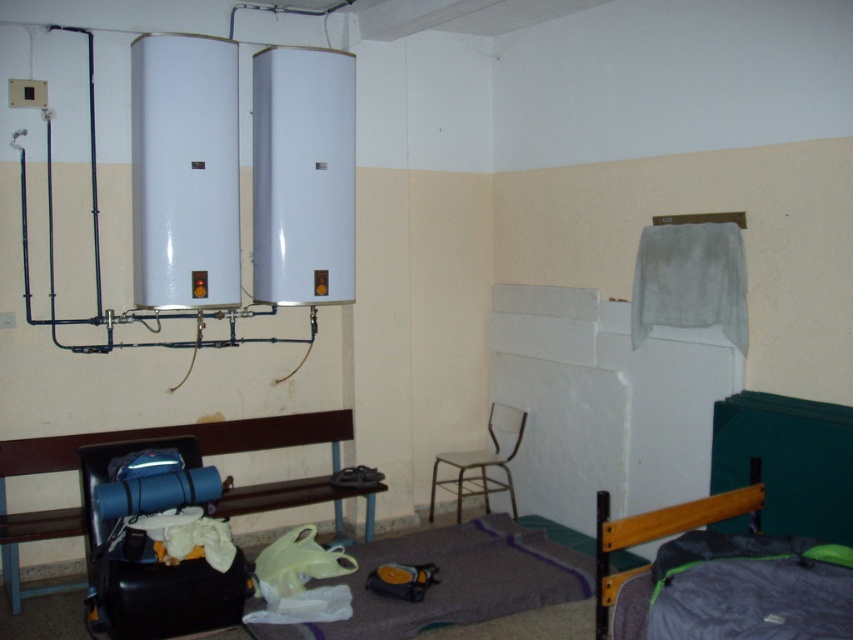
You are moving a new piece of furniture into the room and need to place it near the dark gray fabric bed at lower right. According to the coordinates provided, where exactly should you position the new furniture?

The dark gray fabric bed at lower right is located at point (x=720, y=577), so you should position the new furniture near those coordinates to ensure proper placement.

You are moving into this room and want to place a new rectangular storage box that is 1.2 meters wide between the dark gray fabric bed at lower right and the black leather bench at lower left. Based on their widths, will the combined width of the bed and bench exceed the storage box? Please explain.

The dark gray fabric bed at lower right is narrower than the black leather bench at lower left. Since the storage box is 1.2 meters wide, the combined width of the bed and bench could be more or less than 1.2 meters depending on their individual dimensions. However, without knowing their exact widths, we cannot definitively determine if the combined width exceeds the storage box.

You are standing in the middle of the room and want to move to the dark gray fabric bed at lower right. Which direction should you go relative to the black leather bench at lower left?

You should move to the right of the black leather bench at lower left to reach the dark gray fabric bed at lower right since it is positioned to the right of the black leather bench at lower left.